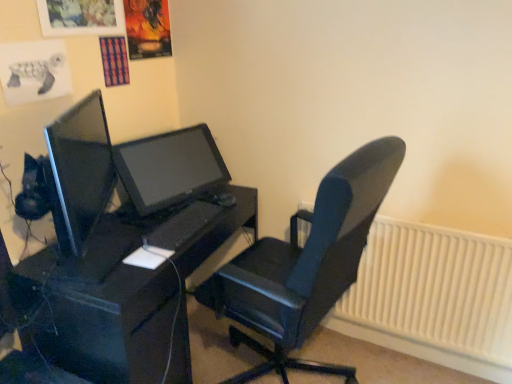
Question: Considering the relative sizes of white plastic radiator at lower right and matte black monitor at center in the image provided, is white plastic radiator at lower right wider than matte black monitor at center?

Choices:
 (A) no
 (B) yes

Answer: (A)

Question: Would you say white plastic radiator at lower right contains matte black monitor at center?

Choices:
 (A) no
 (B) yes

Answer: (A)

Question: Does white plastic radiator at lower right appear on the right side of matte black monitor at center?

Choices:
 (A) yes
 (B) no

Answer: (A)

Question: Considering the relative positions of white plastic radiator at lower right and matte black monitor at center in the image provided, is white plastic radiator at lower right to the left of matte black monitor at center from the viewer's perspective?

Choices:
 (A) yes
 (B) no

Answer: (B)

Question: From a real-world perspective, is white plastic radiator at lower right on top of matte black monitor at center?

Choices:
 (A) yes
 (B) no

Answer: (B)

Question: Considering the relative sizes of white plastic radiator at lower right and matte black monitor at center in the image provided, is white plastic radiator at lower right thinner than matte black monitor at center?

Choices:
 (A) no
 (B) yes

Answer: (B)

Question: Does black leather chair at center appear on the right side of matte black monitor at center?

Choices:
 (A) yes
 (B) no

Answer: (A)

Question: From a real-world perspective, is black leather chair at center below matte black monitor at center?

Choices:
 (A) no
 (B) yes

Answer: (B)

Question: Could matte black monitor at center be considered to be inside black leather chair at center?

Choices:
 (A) no
 (B) yes

Answer: (A)

Question: Is black leather chair at center wider than matte black monitor at center?

Choices:
 (A) no
 (B) yes

Answer: (B)

Question: Can you confirm if black leather chair at center is bigger than matte black monitor at center?

Choices:
 (A) no
 (B) yes

Answer: (B)

Question: Does black leather chair at center have a lesser height compared to matte black monitor at center?

Choices:
 (A) yes
 (B) no

Answer: (B)

Question: Is black matte desk at center touching matte black monitor at center?

Choices:
 (A) no
 (B) yes

Answer: (A)